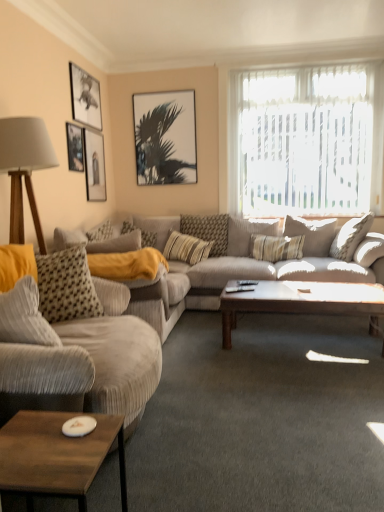
Question: From the image's perspective, is wooden rectangular table at lower left, which appears as the second coffee table when viewed from the back, under translucent fabric at upper right?

Choices:
 (A) yes
 (B) no

Answer: (A)

Question: Is wooden rectangular table at lower left, the 2th coffee table in the right-to-left sequence, wider than translucent fabric at upper right?

Choices:
 (A) no
 (B) yes

Answer: (B)

Question: Can you see wooden rectangular table at lower left, the 1th coffee table from the left, touching translucent fabric at upper right?

Choices:
 (A) yes
 (B) no

Answer: (B)

Question: Is translucent fabric at upper right inside wooden rectangular table at lower left, which appears as the second coffee table when viewed from the back?

Choices:
 (A) yes
 (B) no

Answer: (B)

Question: Can you confirm if wooden rectangular table at lower left, which is the first coffee table from front to back, is positioned to the left of translucent fabric at upper right?

Choices:
 (A) no
 (B) yes

Answer: (B)

Question: Is wooden rectangular table at lower left, the 2th coffee table in the right-to-left sequence, taller than translucent fabric at upper right?

Choices:
 (A) yes
 (B) no

Answer: (B)

Question: Can you confirm if wooden coffee table at center, the 2th coffee table from the left, is bigger than striped fabric pillow at center, positioned as the third pillow in left-to-right order?

Choices:
 (A) no
 (B) yes

Answer: (B)

Question: Is wooden coffee table at center, the first coffee table viewed from the back, positioned beyond the bounds of striped fabric pillow at center, arranged as the 3th pillow when viewed from the right?

Choices:
 (A) no
 (B) yes

Answer: (B)

Question: Does wooden coffee table at center, the first coffee table viewed from the back, appear on the left side of striped fabric pillow at center, arranged as the 3th pillow when viewed from the right?

Choices:
 (A) no
 (B) yes

Answer: (A)

Question: Is wooden coffee table at center, which appears as the second coffee table when viewed from the front, far from striped fabric pillow at center, arranged as the 3th pillow when viewed from the right?

Choices:
 (A) yes
 (B) no

Answer: (A)

Question: From a real-world perspective, is wooden coffee table at center, the first coffee table viewed from the back, on striped fabric pillow at center, arranged as the 3th pillow when viewed from the right?

Choices:
 (A) no
 (B) yes

Answer: (A)

Question: Is striped fabric pillow at center, positioned as the third pillow in left-to-right order, located within wooden coffee table at center, the 2th coffee table from the left?

Choices:
 (A) yes
 (B) no

Answer: (B)

Question: Is matte black picture frame at upper left, which appears as the third picture frame when viewed from the left, far from striped fabric pillow at center, which is the 2th pillow in right-to-left order?

Choices:
 (A) no
 (B) yes

Answer: (B)